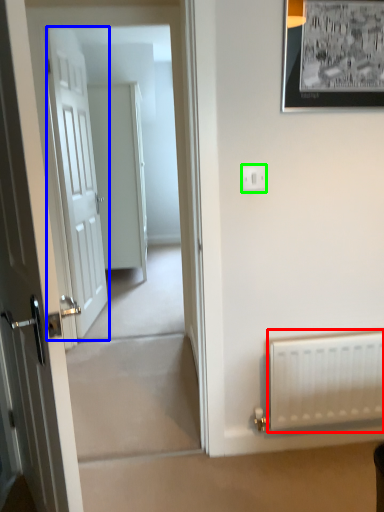
Question: Which is farther away from radiator (highlighted by a red box)? door (highlighted by a blue box) or electric outlet (highlighted by a green box)?

Choices:
 (A) door
 (B) electric outlet

Answer: (A)